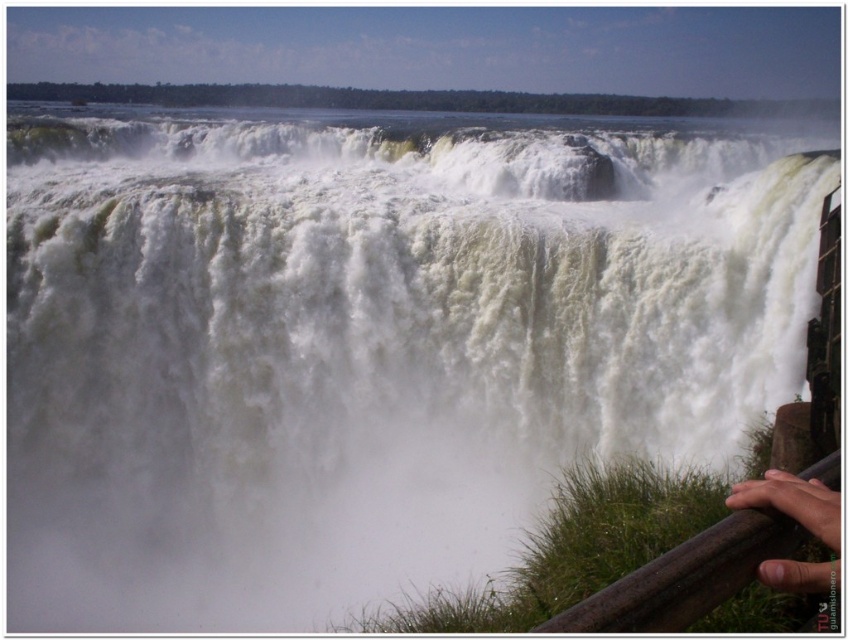
Can you confirm if brown wooden rail at lower right is thinner than skinny flesh at lower right?

No, brown wooden rail at lower right is not thinner than skinny flesh at lower right.

Does brown wooden rail at lower right have a greater height compared to skinny flesh at lower right?

Yes.

Which is behind, point (762, 532) or point (812, 484)?

The point (812, 484) is more distant.

Locate an element on the screen. This screenshot has height=640, width=848. brown wooden rail at lower right is located at coordinates (685, 577).